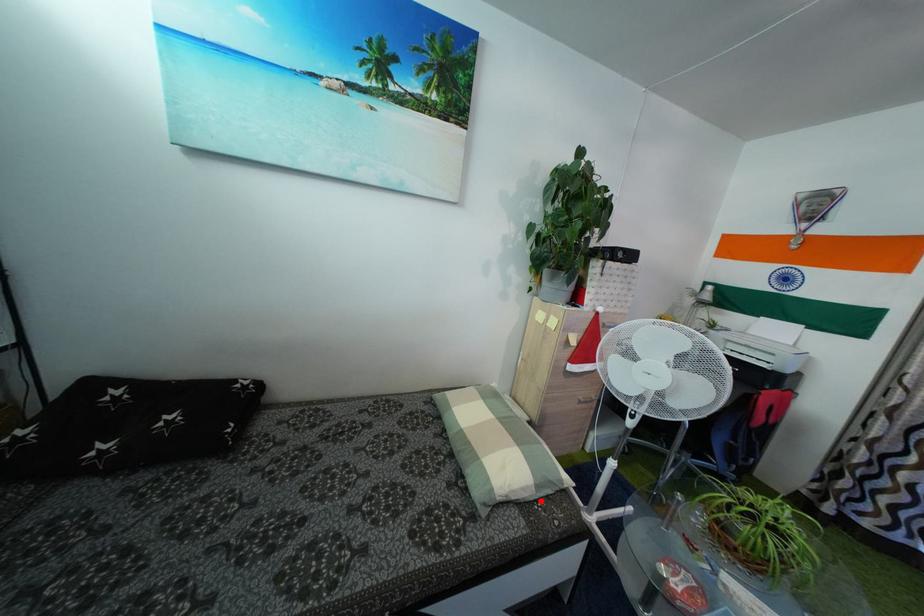
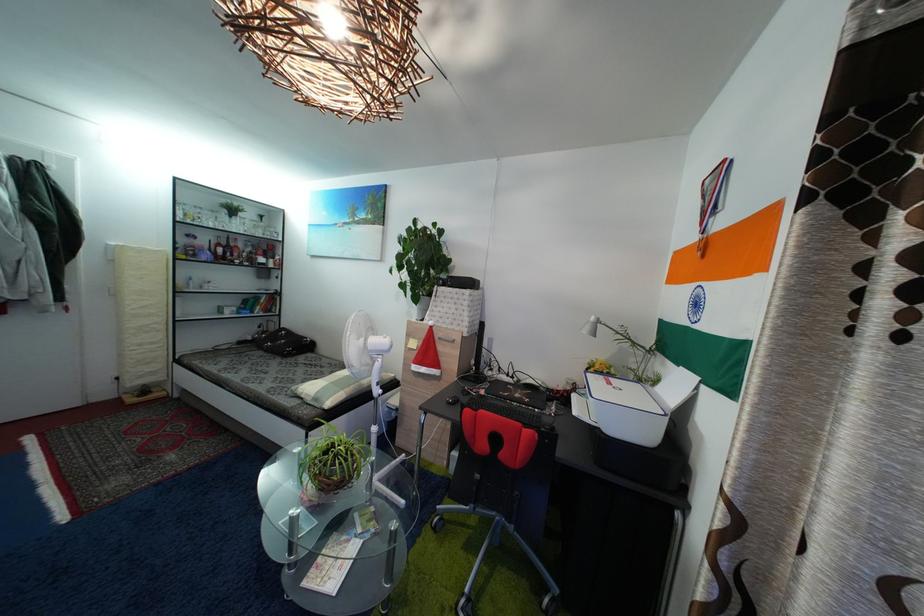
In the second image, find the point that corresponds to the highlighted location in the first image.

(318, 407)